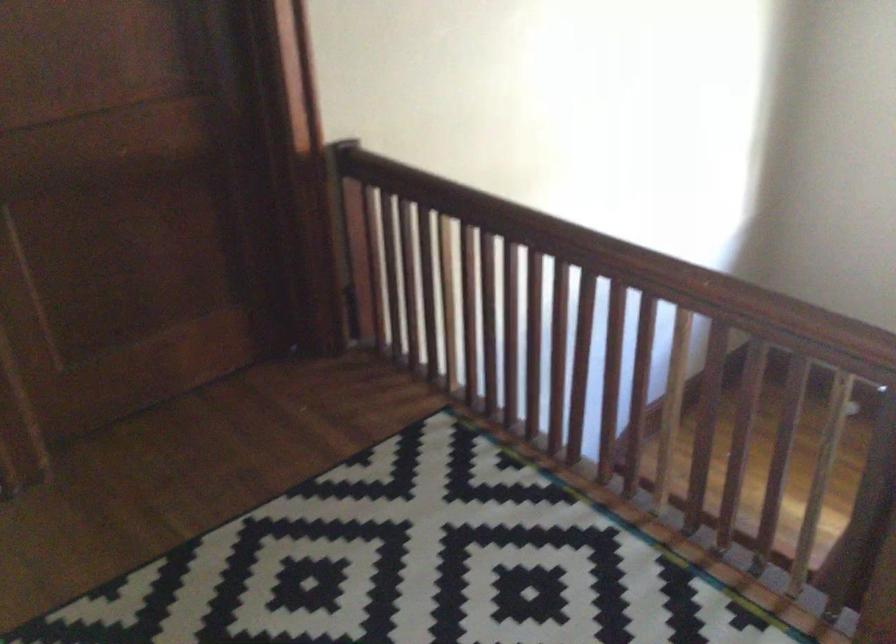
Question: The camera is either moving clockwise (left) or counter-clockwise (right) around the object. The first image is from the beginning of the video and the second image is from the end. Is the camera moving left or right when shooting the video?

Choices:
 (A) Left
 (B) Right

Answer: (B)